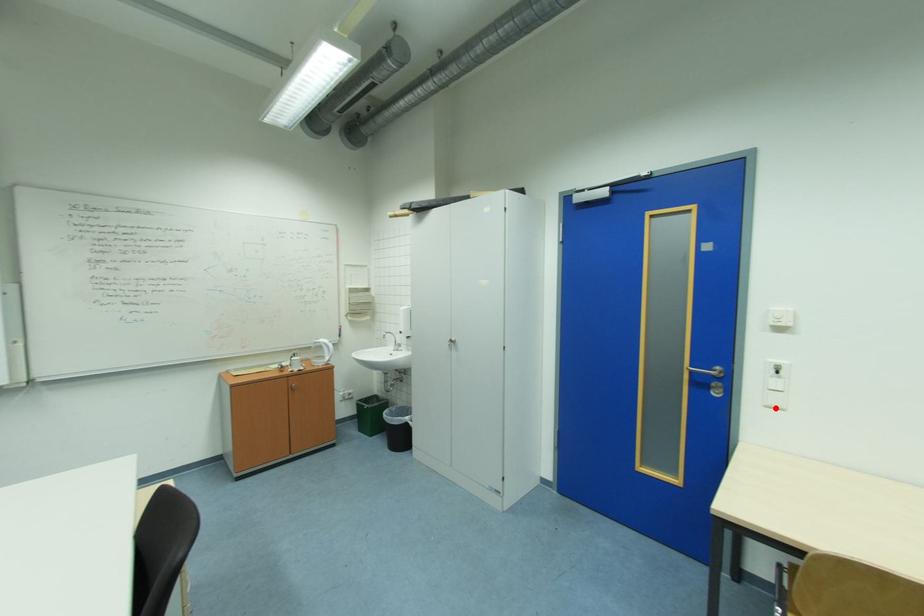
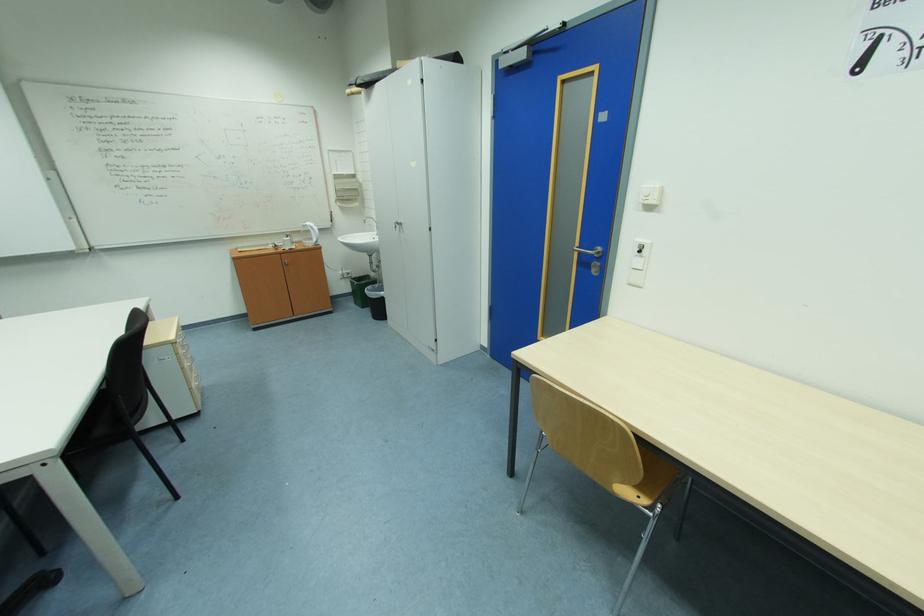
Locate, in the second image, the point that corresponds to the highlighted location in the first image.

(638, 286)